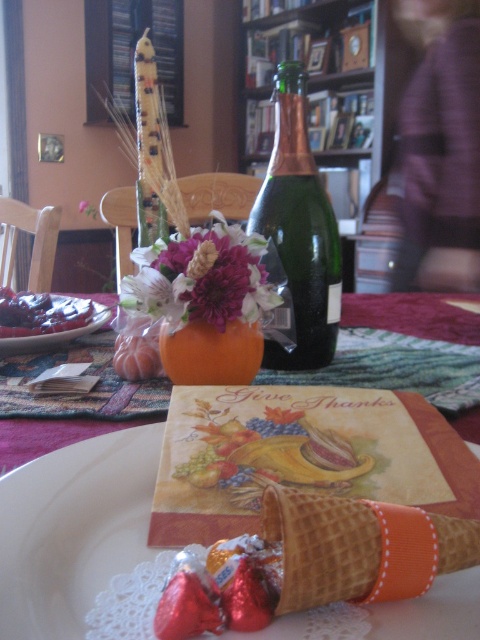
Is matte floral arrangement at center below matte plastic grapes at left?

Correct, matte floral arrangement at center is located below matte plastic grapes at left.

Which is behind, point (280, 326) or point (47, 321)?

The point (47, 321) is behind.

The image size is (480, 640). Identify the location of matte floral arrangement at center. (197, 280).

Can you confirm if green glass bottle at center is shorter than orange matte pumpkin at center?

No, green glass bottle at center is not shorter than orange matte pumpkin at center.

Is green glass bottle at center bigger than orange matte pumpkin at center?

Yes, green glass bottle at center is bigger than orange matte pumpkin at center.

Which is in front, point (287, 211) or point (205, 372)?

Point (205, 372) is in front.

At what (x,y) coordinates should I click in order to perform the action: click on green glass bottle at center. Please return your answer as a coordinate pair (x, y). Image resolution: width=480 pixels, height=640 pixels. Looking at the image, I should click on (300, 228).

Who is lower down, matte orange vase at center or green glass bottle at center?

Positioned lower is matte orange vase at center.

What do you see at coordinates (70, 516) in the screenshot? I see `matte orange vase at center` at bounding box center [70, 516].

This screenshot has width=480, height=640. What do you see at coordinates (70, 516) in the screenshot?
I see `matte orange vase at center` at bounding box center [70, 516].

This screenshot has width=480, height=640. What are the coordinates of `matte orange vase at center` in the screenshot? It's located at (70, 516).